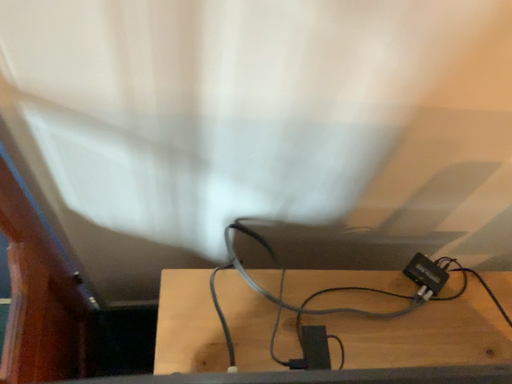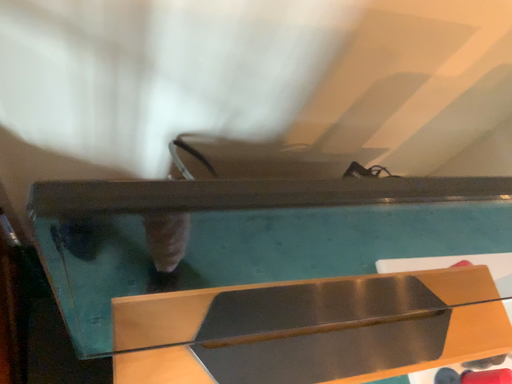
Question: How did the camera likely rotate when shooting the video?

Choices:
 (A) rotated upward
 (B) rotated downward

Answer: (B)